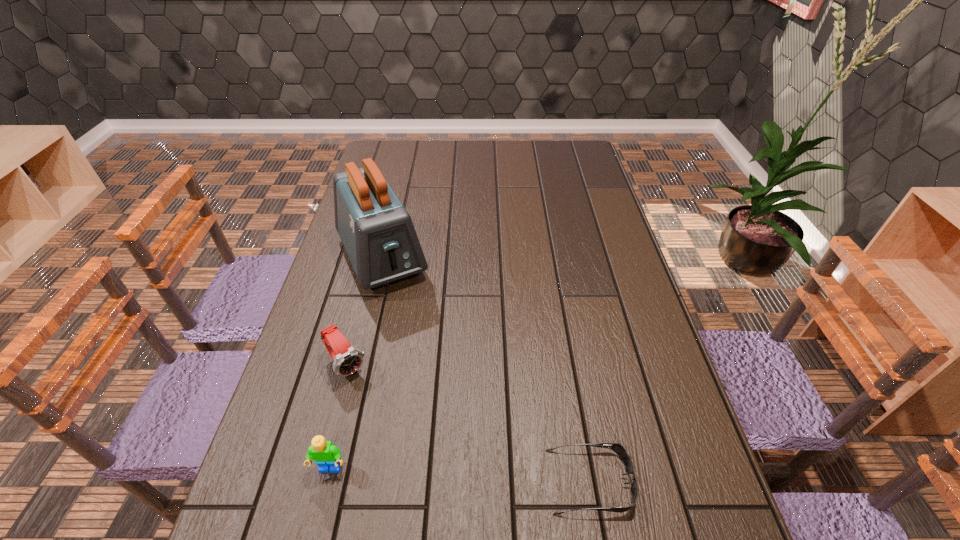
The image size is (960, 540). Identify the location of vacant point located between the Lego and the watch. click(x=338, y=417).

Where is `free space between the third nearest object and the shortest object`? This screenshot has height=540, width=960. free space between the third nearest object and the shortest object is located at coordinates (468, 423).

This screenshot has width=960, height=540. Identify the location of vacant region between the toaster and the watch. (364, 312).

The width and height of the screenshot is (960, 540). Find the location of `vacant area that lies between the Lego and the watch`. vacant area that lies between the Lego and the watch is located at coordinates click(x=338, y=417).

Identify the location of unoccupied area between the watch and the Lego. The height and width of the screenshot is (540, 960). (338, 417).

Where is `vacant space that's between the watch and the farthest object`? Image resolution: width=960 pixels, height=540 pixels. vacant space that's between the watch and the farthest object is located at coordinates (364, 312).

Locate an element on the screen. The width and height of the screenshot is (960, 540). the closest object to the Lego is located at coordinates (347, 359).

Identify the location of the closest object relative to the shortest object. (327, 456).

This screenshot has height=540, width=960. I want to click on vacant space that satisfies the following two spatial constraints: 1. on the front side of the farthest object; 2. on the front-facing side of the sunglasses, so click(x=328, y=481).

Find the location of `vacant area in the image that satisfies the following two spatial constraints: 1. on the face of the shortest object; 2. on the front-facing side of the Lego`. vacant area in the image that satisfies the following two spatial constraints: 1. on the face of the shortest object; 2. on the front-facing side of the Lego is located at coordinates (327, 481).